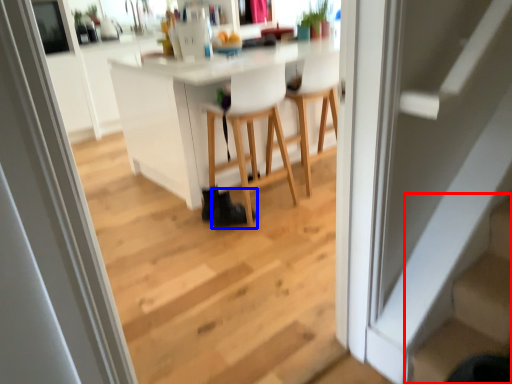
Question: Which object appears closest to the camera in this image, stairs (highlighted by a red box) or shoe (highlighted by a blue box)?

Choices:
 (A) stairs
 (B) shoe

Answer: (A)